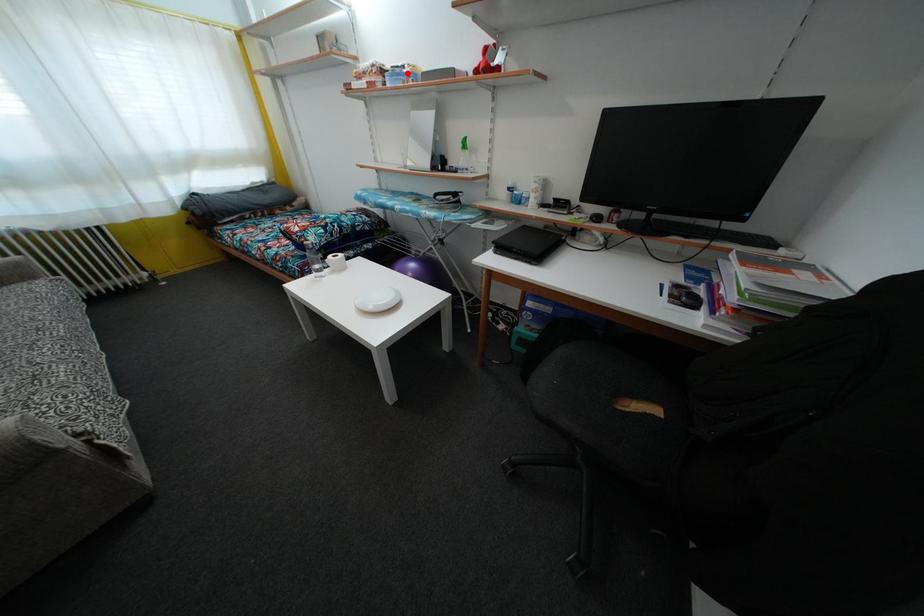
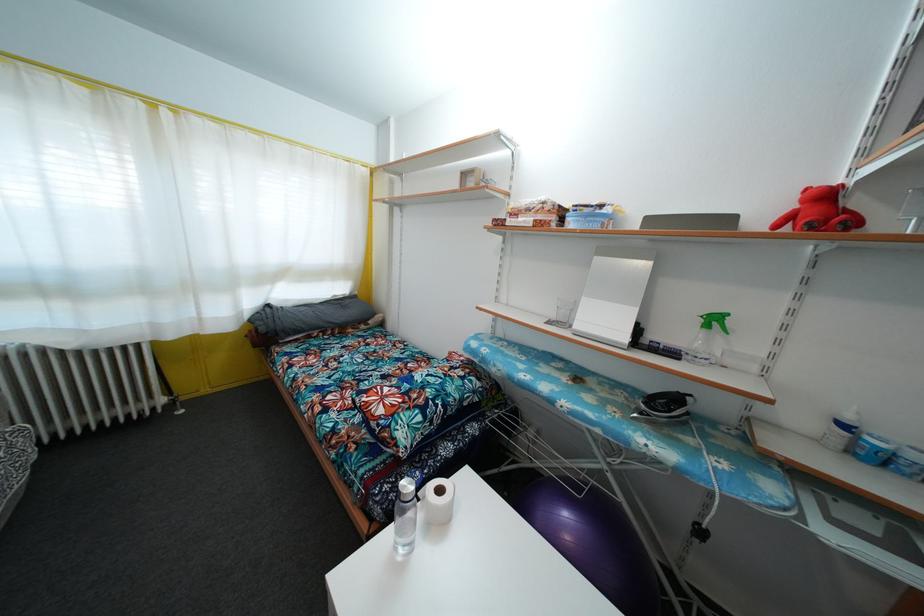
Where in the second image is the point corresponding to the highlighted location from the first image?

(605, 213)